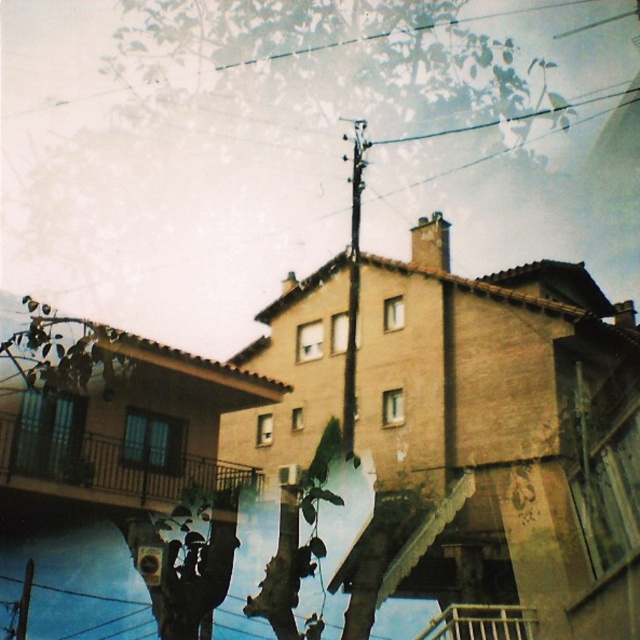
Question: Is black metal balcony at lower left thinner than wooden at lower center?

Choices:
 (A) no
 (B) yes

Answer: (B)

Question: Which point is farther from the camera taking this photo?

Choices:
 (A) (56, 371)
 (B) (452, 627)
 (C) (349, 449)
 (D) (220, 461)

Answer: (D)

Question: Which point is farther to the camera?

Choices:
 (A) black metal balcony at lower left
 (B) green leafy tree at upper left
 (C) wooden at lower center

Answer: (A)

Question: Among these objects, which one is nearest to the camera?

Choices:
 (A) green matte tree at center
 (B) black metal balcony at lower left
 (C) green leafy tree at center

Answer: (C)

Question: Can you confirm if green matte tree at center is positioned above wooden at lower center?

Choices:
 (A) no
 (B) yes

Answer: (A)

Question: Does green leafy tree at center have a smaller size compared to wooden at lower center?

Choices:
 (A) no
 (B) yes

Answer: (A)